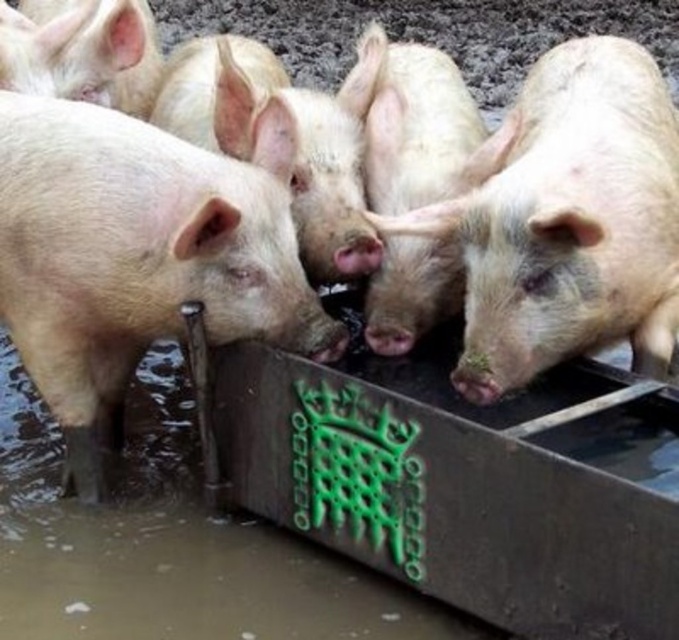
You are a farmer checking the pigs in the trough. You notice a pig represented by point coordinates at point (139,257). Where is this pig located relative to the trough?

The pig represented by point (139,257) is at the center of the trough.

In the scene with a metal trough and two pink matte pigs, which pig is positioned to the right when observing the pink matte pig at center and the pink matte piglet at center?

The pink matte piglet at center is positioned to the right of the pink matte pig at center.

You are a farmer who wants to measure the distance between the pink matte pig at center and the nearest pig. Can you confirm if the distance is more than 2 meters?

The distance between the pink matte pig at center and the nearest pig is 2.01 meters, which is more than 2 meters.